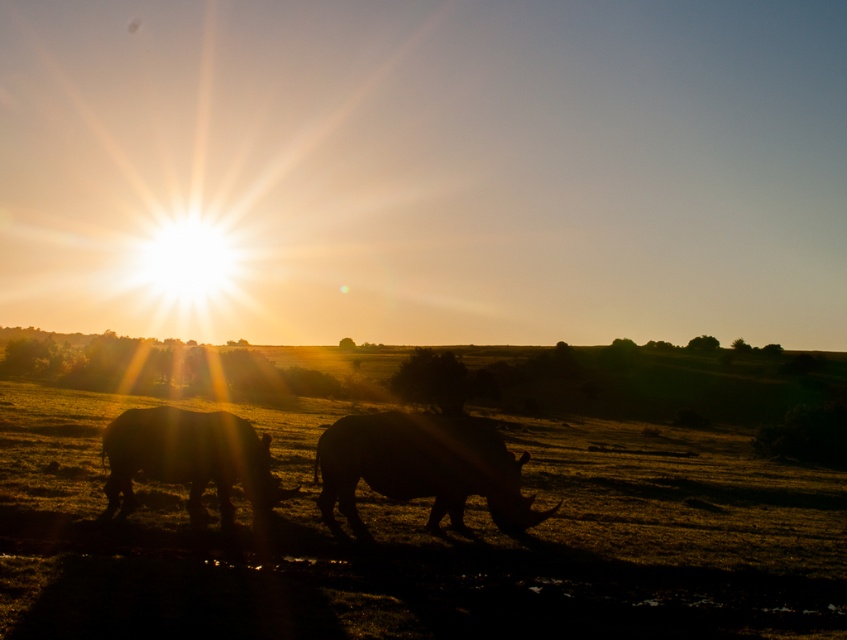
Question: Can you confirm if silhouette horned at center is positioned to the right of silhouette horned animal at center?

Choices:
 (A) yes
 (B) no

Answer: (A)

Question: Can you confirm if silhouette horned at center is positioned to the right of silhouette horned animal at center?

Choices:
 (A) yes
 (B) no

Answer: (A)

Question: Observing the image, what is the correct spatial positioning of silhouette horned at center in reference to silhouette horned animal at center?

Choices:
 (A) above
 (B) below

Answer: (B)

Question: Which point is farther from the camera taking this photo?

Choices:
 (A) (114, 461)
 (B) (397, 452)

Answer: (A)